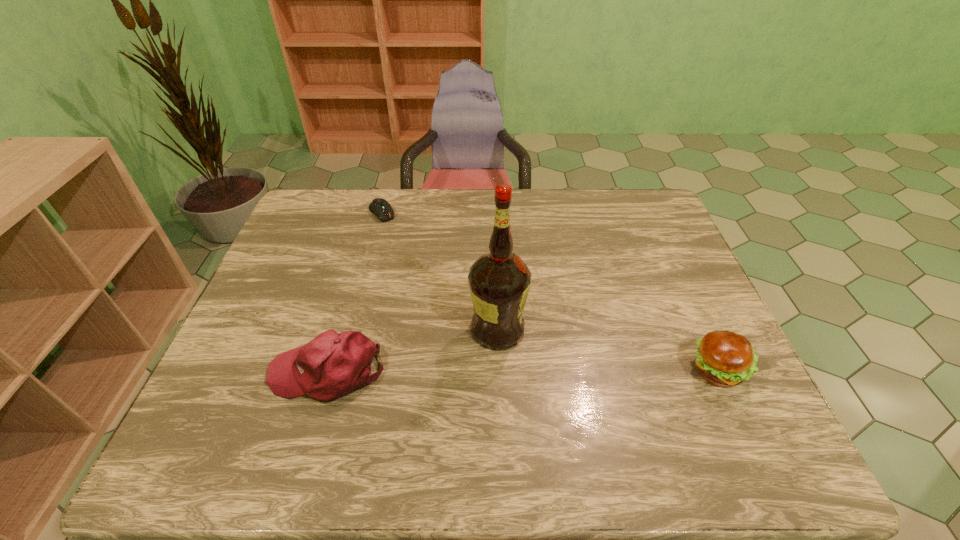
Find the location of `vacant space that satisfies the following two spatial constraints: 1. on the front side of the computer equipment; 2. on the right side of the second shortest object`. vacant space that satisfies the following two spatial constraints: 1. on the front side of the computer equipment; 2. on the right side of the second shortest object is located at coordinates (339, 372).